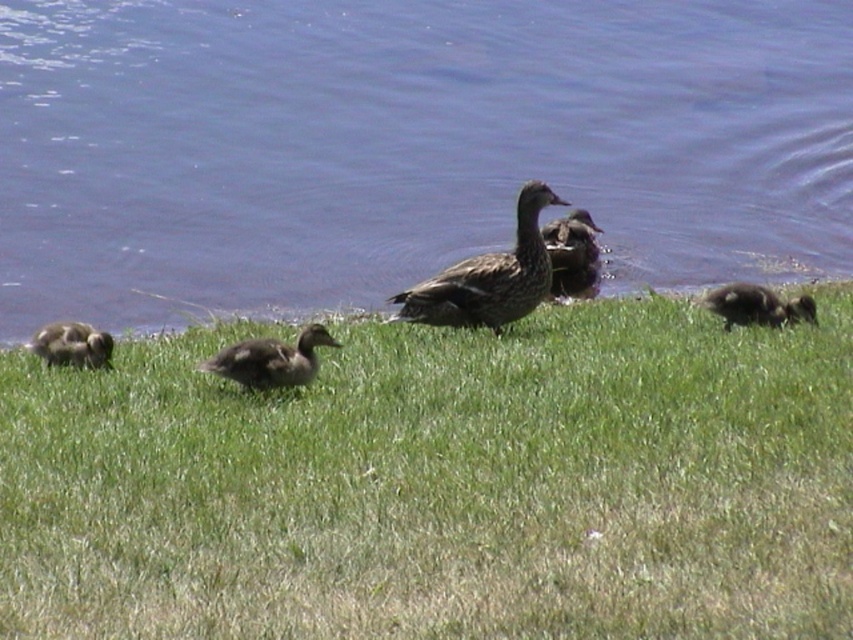
Question: Estimate the real-world distances between objects in this image. Which object is farther from the green grassy at center?

Choices:
 (A) brown matte duck at center
 (B) brown fuzzy duckling at lower left
 (C) dark brown fuzzy duckling at lower right
 (D) blue water at center

Answer: (D)

Question: Does blue water at center appear under brown fuzzy duckling at lower left?

Choices:
 (A) no
 (B) yes

Answer: (A)

Question: Which point appears farthest from the camera in this image?

Choices:
 (A) (334, 348)
 (B) (724, 301)
 (C) (415, 300)
 (D) (790, 376)

Answer: (C)

Question: Is brown matte duck at center below brown matte duckling at center?

Choices:
 (A) no
 (B) yes

Answer: (B)

Question: Is blue water at center smaller than brown matte duckling at center?

Choices:
 (A) no
 (B) yes

Answer: (A)

Question: Which of these objects is positioned farthest from the dark brown fuzzy duckling at lower right?

Choices:
 (A) brown matte duckling at center
 (B) green grassy at center

Answer: (A)